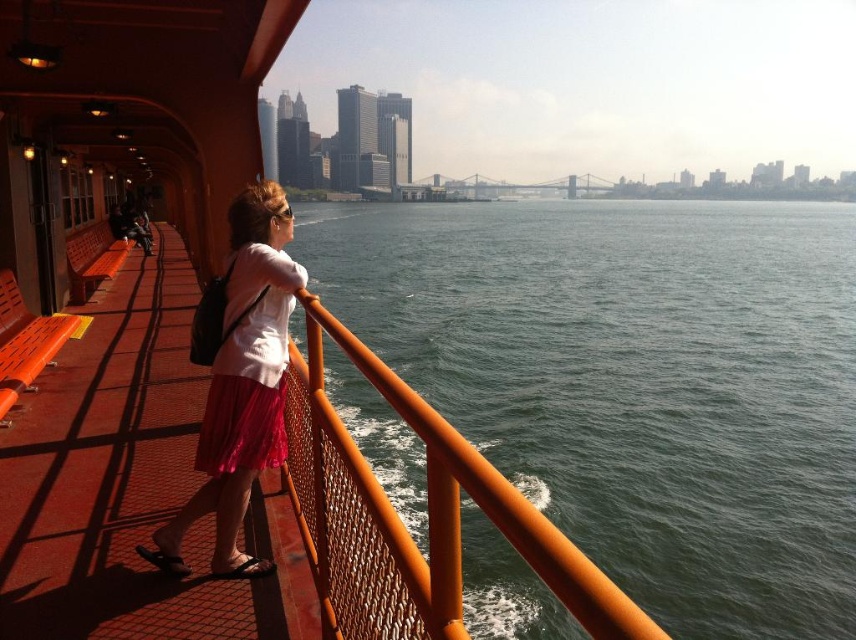
Question: In this image, where is green water at center located relative to pink satin skirt at center?

Choices:
 (A) right
 (B) left

Answer: (A)

Question: Which point is farther to the camera?

Choices:
 (A) (224, 524)
 (B) (286, 282)
 (C) (34, 582)
 (D) (514, 324)

Answer: (D)

Question: Which point is closer to the camera?

Choices:
 (A) pink satin skirt at center
 (B) pink pleated skirt at center
 (C) orange mesh deck at center

Answer: (C)

Question: Which of the following is the farthest from the observer?

Choices:
 (A) (6, 556)
 (B) (288, 296)
 (C) (268, 321)
 (D) (791, 614)

Answer: (D)

Question: Is orange mesh deck at center closer to camera compared to pink pleated skirt at center?

Choices:
 (A) yes
 (B) no

Answer: (A)

Question: Is green water at center further to camera compared to orange mesh deck at center?

Choices:
 (A) yes
 (B) no

Answer: (A)